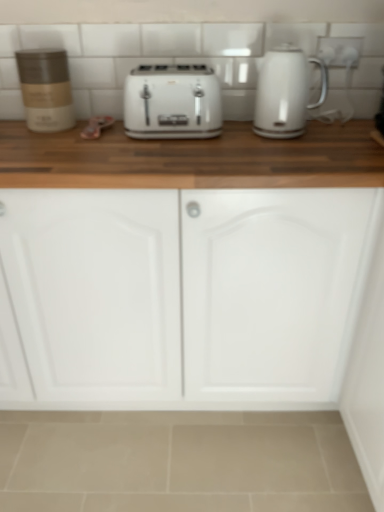
Identify the location of vacant area on top of white glossy toaster at center (from a real-world perspective). (168, 73).